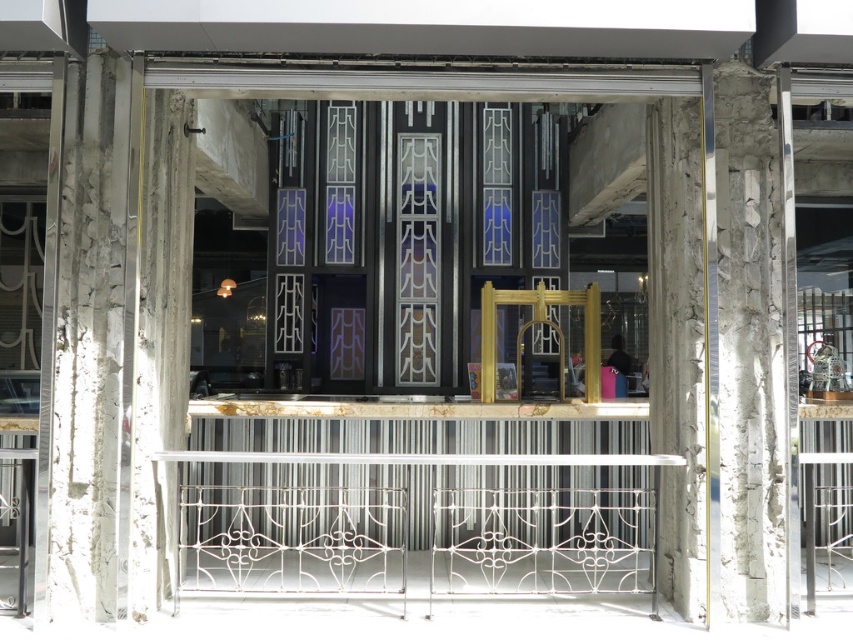
You are standing in front of the modern architectural structure and want to enter through the doorway. Where is the black glass door at center located in relation to the weathered concrete pillars framing the doorway?

A: The black glass door at center is located at point coordinates of 0.388 on the x axis and 0.470 on the y axis, so it is positioned slightly to the left and lower center of the doorway framed by the weathered concrete pillars.